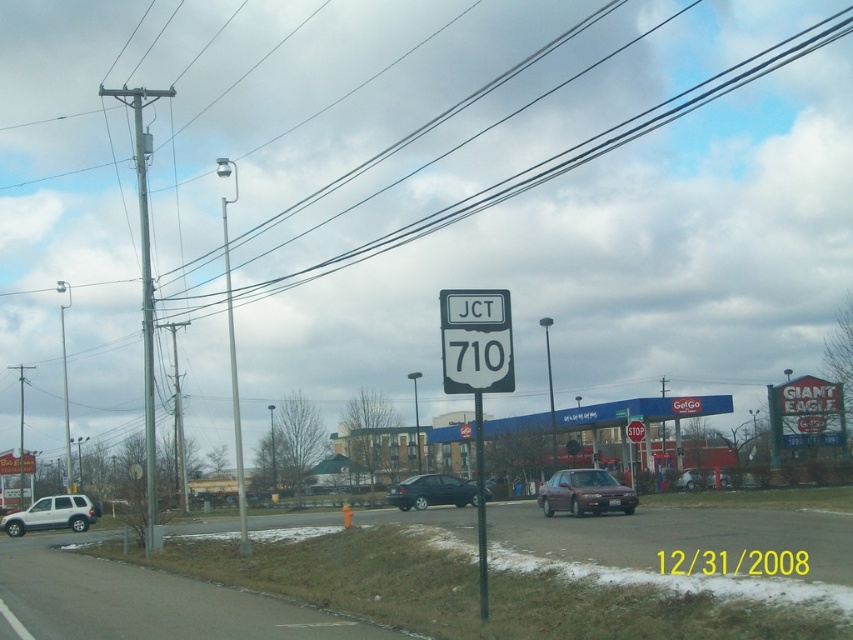
Is white plastic road sign at center taller than matte silver sedan at center?

Incorrect, white plastic road sign at center's height is not larger of matte silver sedan at center's.

Measure the distance between point [485,332] and camera.

They are 12.29 meters apart.

The width and height of the screenshot is (853, 640). What do you see at coordinates (476, 340) in the screenshot?
I see `white plastic road sign at center` at bounding box center [476, 340].

Image resolution: width=853 pixels, height=640 pixels. What are the coordinates of `white plastic road sign at center` in the screenshot? It's located at (476, 340).

Find the location of `satin silver sedan at center`. satin silver sedan at center is located at coordinates (584, 492).

Is satin silver sedan at center positioned in front of white matte suv at lower left?

Yes.

Image resolution: width=853 pixels, height=640 pixels. What do you see at coordinates (584, 492) in the screenshot? I see `satin silver sedan at center` at bounding box center [584, 492].

The width and height of the screenshot is (853, 640). In order to click on satin silver sedan at center in this screenshot , I will do [x=584, y=492].

Is point (456, 493) in front of point (705, 484)?

No, it is not.

Between point (418, 488) and point (686, 483), which one is positioned in front?

Point (418, 488)

Describe the element at coordinates (431, 492) in the screenshot. The width and height of the screenshot is (853, 640). I see `shiny black sedan at center` at that location.

Where is `shiny black sedan at center`? This screenshot has width=853, height=640. shiny black sedan at center is located at coordinates (431, 492).